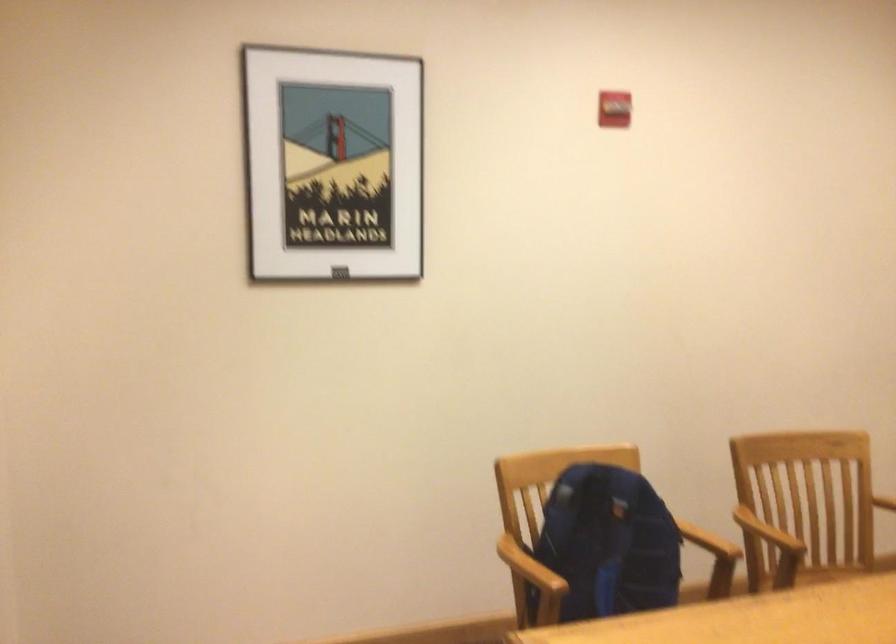
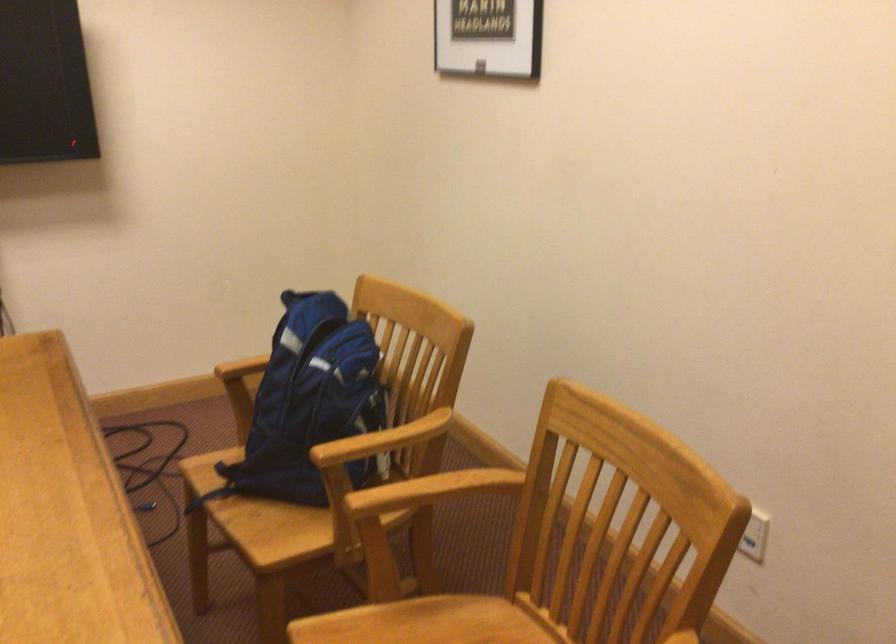
Question: I am providing you with two images of the same scene from different viewpoints. After the viewpoint changes to image2, which objects are now occluded?

Choices:
 (A) red phone case
 (B) wooden chair armrest
 (C) chair sitting surface
 (D) blue backpack

Answer: (B)